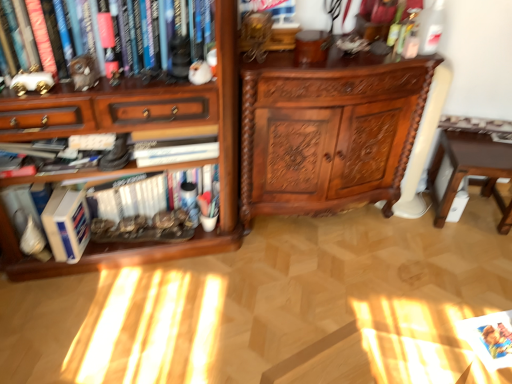
This screenshot has width=512, height=384. In order to click on vacant space underneath polished wood cabinet at center (from a real-world perspective) in this screenshot , I will do `click(317, 222)`.